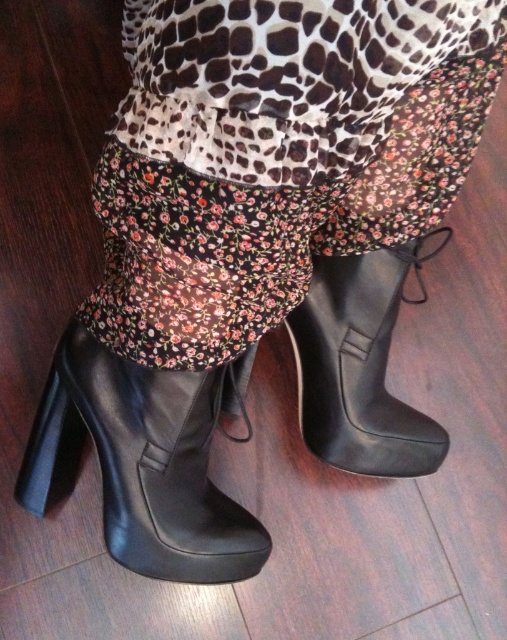
Question: Does floral fabric skirt at center have a larger size compared to black leather boot at lower center?

Choices:
 (A) no
 (B) yes

Answer: (B)

Question: Which point is closer to the camera?

Choices:
 (A) (322, 452)
 (B) (94, 436)
 (C) (383, 10)

Answer: (C)

Question: Can you confirm if floral fabric skirt at center is positioned above black leather boot at lower left?

Choices:
 (A) no
 (B) yes

Answer: (B)

Question: Which object is farther from the camera taking this photo?

Choices:
 (A) black leather boot at lower left
 (B) black leather boot at lower center
 (C) floral fabric skirt at center

Answer: (B)

Question: Observing the image, what is the correct spatial positioning of floral fabric skirt at center in reference to black leather boot at lower center?

Choices:
 (A) left
 (B) right

Answer: (A)

Question: Among these objects, which one is nearest to the camera?

Choices:
 (A) floral fabric skirt at center
 (B) black leather boot at lower left
 (C) black leather boot at lower center

Answer: (A)